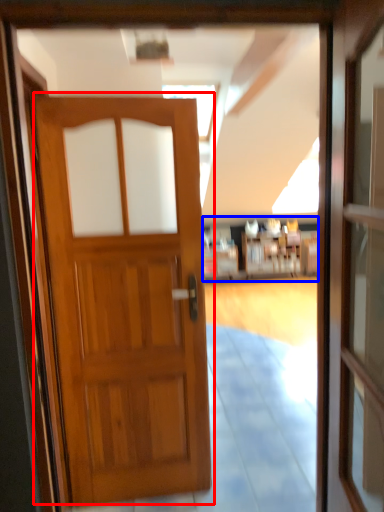
Question: Among these objects, which one is farthest to the camera, door (highlighted by a red box) or hotel lobby (highlighted by a blue box)?

Choices:
 (A) door
 (B) hotel lobby

Answer: (B)